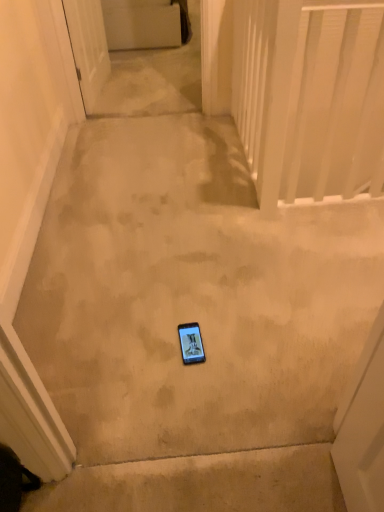
The image size is (384, 512). What do you see at coordinates (191, 343) in the screenshot?
I see `matte black phone at center` at bounding box center [191, 343].

The image size is (384, 512). Describe the element at coordinates (310, 96) in the screenshot. I see `white plastic balustrade at upper right` at that location.

The height and width of the screenshot is (512, 384). I want to click on white plastic balustrade at upper right, so click(310, 96).

What do you see at coordinates (88, 47) in the screenshot? The image size is (384, 512). I see `white glossy door at upper left` at bounding box center [88, 47].

Identify the location of matte black phone at center. Image resolution: width=384 pixels, height=512 pixels. (191, 343).

Looking at this image, considering the positions of objects white plastic balustrade at upper right and white glossy door at upper left in the image provided, who is in front, white plastic balustrade at upper right or white glossy door at upper left?

white plastic balustrade at upper right is more forward.

Is white plastic balustrade at upper right not within white glossy door at upper left?

Indeed, white plastic balustrade at upper right is completely outside white glossy door at upper left.

How far apart are white plastic balustrade at upper right and white glossy door at upper left?

The distance of white plastic balustrade at upper right from white glossy door at upper left is 4.25 feet.

From a real-world perspective, is white plastic balustrade at upper right positioned above or below white glossy door at upper left?

In terms of real-world spatial position, white plastic balustrade at upper right is above white glossy door at upper left.

Which of these two, matte black phone at center or white plastic balustrade at upper right, is bigger?

white plastic balustrade at upper right is bigger.

In the scene shown: In terms of width, does matte black phone at center look wider or thinner when compared to white plastic balustrade at upper right?

In the image, matte black phone at center appears to be more narrow than white plastic balustrade at upper right.

Do you think matte black phone at center is within white plastic balustrade at upper right, or outside of it?

matte black phone at center is spatially situated outside white plastic balustrade at upper right.

From the image's perspective, is matte black phone at center under white plastic balustrade at upper right?

Yes, from the image's perspective, matte black phone at center is beneath white plastic balustrade at upper right.

Is white glossy door at upper left not near white plastic balustrade at upper right?

Indeed, white glossy door at upper left is not near white plastic balustrade at upper right.

Which is behind, white glossy door at upper left or white plastic balustrade at upper right?

white glossy door at upper left is further away from the camera.

From a real-world perspective, is white glossy door at upper left positioned over white plastic balustrade at upper right based on gravity?

No.

Considering the relative sizes of white plastic balustrade at upper right and matte black phone at center in the image provided, is white plastic balustrade at upper right bigger than matte black phone at center?

Correct, white plastic balustrade at upper right is larger in size than matte black phone at center.

Does white plastic balustrade at upper right lie behind matte black phone at center?

Yes, white plastic balustrade at upper right is behind matte black phone at center.

Between point (99, 3) and point (184, 329), which one is positioned in front?

The point (184, 329) is closer.

Which is more to the left, white glossy door at upper left or matte black phone at center?

Positioned to the left is white glossy door at upper left.

Consider the image. Can you confirm if white glossy door at upper left is wider than matte black phone at center?

Indeed, white glossy door at upper left has a greater width compared to matte black phone at center.

Can you confirm if white glossy door at upper left is taller than matte black phone at center?

Indeed, white glossy door at upper left has a greater height compared to matte black phone at center.

Is matte black phone at center placed right next to white glossy door at upper left?

They are not placed beside each other.

Does matte black phone at center have a lesser width compared to white glossy door at upper left?

Yes.

Consider the image. Considering the relative sizes of matte black phone at center and white glossy door at upper left in the image provided, is matte black phone at center smaller than white glossy door at upper left?

Indeed, matte black phone at center has a smaller size compared to white glossy door at upper left.

Based on the photo, from their relative heights in the image, would you say matte black phone at center is taller or shorter than white glossy door at upper left?

Clearly, matte black phone at center is shorter compared to white glossy door at upper left.

At what (x,y) coordinates should I click in order to perform the action: click on door that is under the white plastic balustrade at upper right (from a real-world perspective). Please return your answer as a coordinate pair (x, y). Looking at the image, I should click on (88, 47).

Identify the location of mobile phone in front of the white plastic balustrade at upper right. The height and width of the screenshot is (512, 384). (191, 343).

When comparing their distances from white glossy door at upper left, does matte black phone at center or white plastic balustrade at upper right seem further?

matte black phone at center.

Estimate the real-world distances between objects in this image. Which object is closer to white plastic balustrade at upper right, matte black phone at center or white glossy door at upper left?

white glossy door at upper left lies closer to white plastic balustrade at upper right than the other object.

From the image, which object appears to be nearer to white glossy door at upper left, white plastic balustrade at upper right or matte black phone at center?

Based on the image, white plastic balustrade at upper right appears to be nearer to white glossy door at upper left.

From the image, which object appears to be nearer to white plastic balustrade at upper right, white glossy door at upper left or matte black phone at center?

white glossy door at upper left is positioned closer to the anchor white plastic balustrade at upper right.

When comparing their distances from matte black phone at center, does white plastic balustrade at upper right or white glossy door at upper left seem further?

white glossy door at upper left is further to matte black phone at center.

Looking at the image, which one is located further to matte black phone at center, white glossy door at upper left or white plastic balustrade at upper right?

Based on the image, white glossy door at upper left appears to be further to matte black phone at center.

The height and width of the screenshot is (512, 384). I want to click on balustrade between white glossy door at upper left and matte black phone at center in the vertical direction, so click(310, 96).